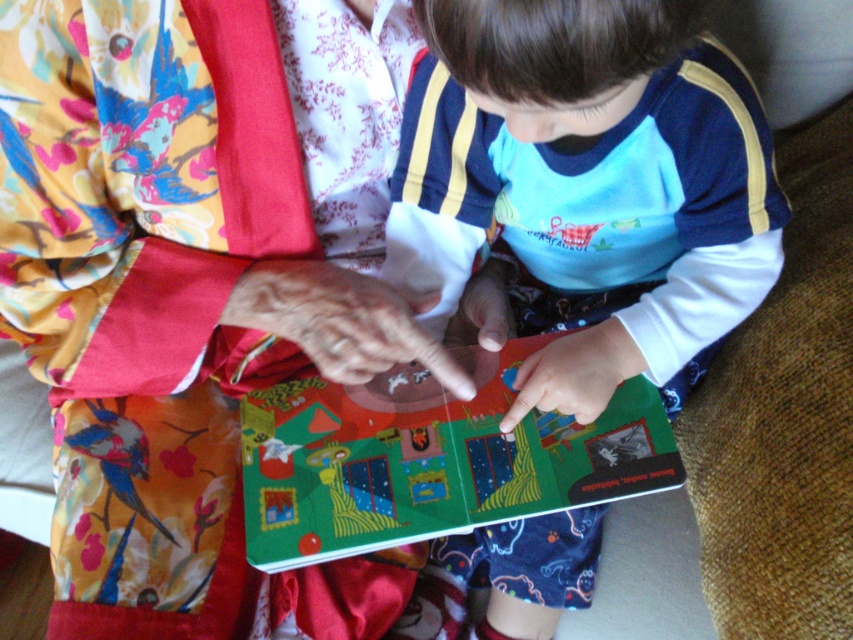
Where is `matte green book at center`? The image size is (853, 640). matte green book at center is located at coordinates (589, 182).

Can you confirm if matte green book at center is taller than matte paper book at center?

Yes.

What do you see at coordinates (589, 182) in the screenshot?
I see `matte green book at center` at bounding box center [589, 182].

Find the location of a particular element. matte green book at center is located at coordinates (589, 182).

Between floral silk kimono at center and matte paper book at center, which one has less height?

matte paper book at center

Is floral silk kimono at center thinner than matte paper book at center?

Yes, floral silk kimono at center is thinner than matte paper book at center.

Does point (112, 388) come farther from viewer compared to point (337, 451)?

No, (112, 388) is closer to viewer.

Where is `floral silk kimono at center`? The height and width of the screenshot is (640, 853). floral silk kimono at center is located at coordinates (158, 307).

Does floral silk kimono at center appear on the left side of matte green book at center?

Indeed, floral silk kimono at center is positioned on the left side of matte green book at center.

Which is behind, point (10, 109) or point (695, 362)?

The point (695, 362) is more distant.

Where is `floral silk kimono at center`? The width and height of the screenshot is (853, 640). floral silk kimono at center is located at coordinates (158, 307).